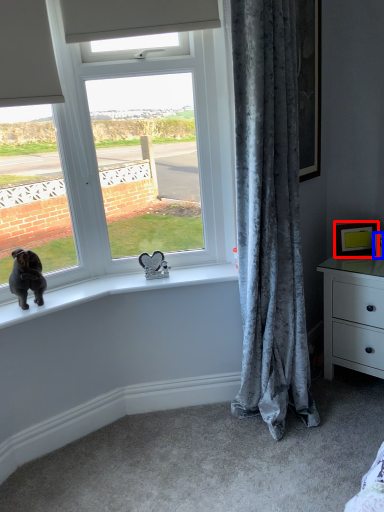
Question: Which object is closer to the camera taking this photo, picture frame (highlighted by a red box) or picture frame (highlighted by a blue box)?

Choices:
 (A) picture frame
 (B) picture frame

Answer: (B)